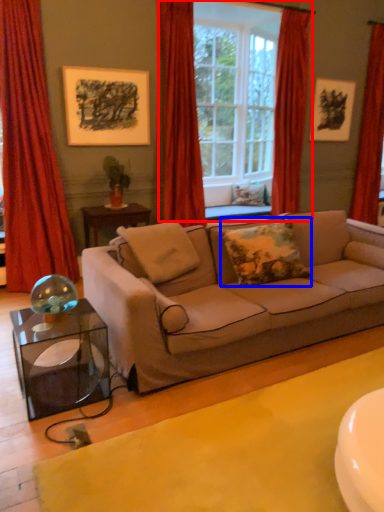
Question: Which point is further to the camera, window (highlighted by a red box) or pillow (highlighted by a blue box)?

Choices:
 (A) window
 (B) pillow

Answer: (A)